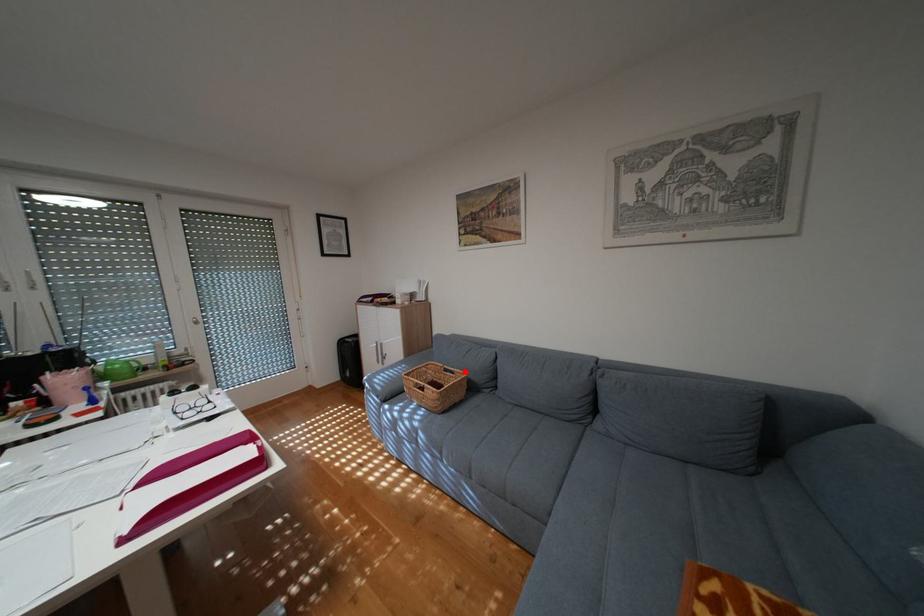
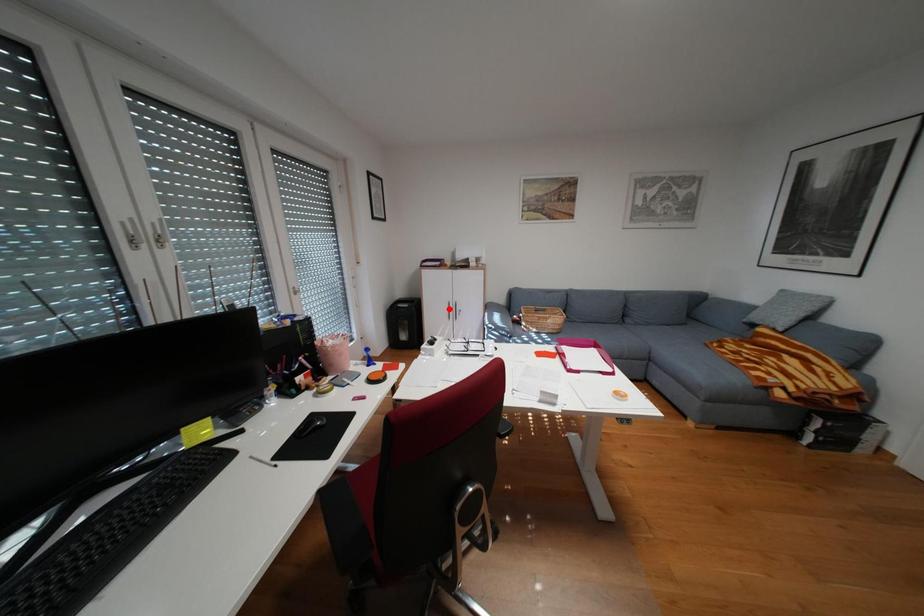
I am providing you with two images of the same scene from different viewpoints. A red point is marked on the first image and another point is marked on the second image. Are the points marked in image1 and image2 representing the same 3D position?

No